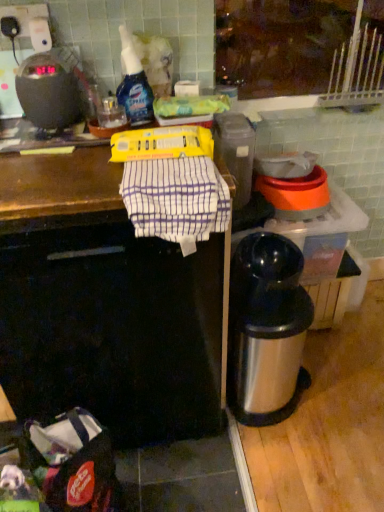
Question: Is black plastic scale at upper left to the left of silver metallic thermos at lower right from the viewer's perspective?

Choices:
 (A) no
 (B) yes

Answer: (B)

Question: Considering the relative positions of black plastic scale at upper left and silver metallic thermos at lower right in the image provided, is black plastic scale at upper left behind silver metallic thermos at lower right?

Choices:
 (A) yes
 (B) no

Answer: (B)

Question: Is black plastic scale at upper left thinner than silver metallic thermos at lower right?

Choices:
 (A) no
 (B) yes

Answer: (B)

Question: From the image's perspective, is black plastic scale at upper left located beneath silver metallic thermos at lower right?

Choices:
 (A) no
 (B) yes

Answer: (A)

Question: Can you confirm if black plastic scale at upper left is shorter than silver metallic thermos at lower right?

Choices:
 (A) yes
 (B) no

Answer: (A)

Question: In terms of height, does translucent plastic spray bottle at upper center look taller or shorter compared to black plastic scale at upper left?

Choices:
 (A) short
 (B) tall

Answer: (B)

Question: Based on their sizes in the image, would you say translucent plastic spray bottle at upper center is bigger or smaller than black plastic scale at upper left?

Choices:
 (A) big
 (B) small

Answer: (B)

Question: Is point (122, 103) closer or farther from the camera than point (46, 60)?

Choices:
 (A) closer
 (B) farther

Answer: (B)

Question: From the image's perspective, is translucent plastic spray bottle at upper center above or below black plastic scale at upper left?

Choices:
 (A) above
 (B) below

Answer: (A)

Question: Looking at their shapes, would you say translucent plastic spray bottle at upper center is wider or thinner than silver metallic thermos at lower right?

Choices:
 (A) wide
 (B) thin

Answer: (B)

Question: From the image's perspective, is translucent plastic spray bottle at upper center positioned above or below silver metallic thermos at lower right?

Choices:
 (A) above
 (B) below

Answer: (A)

Question: Considering their positions, is translucent plastic spray bottle at upper center located in front of or behind silver metallic thermos at lower right?

Choices:
 (A) front
 (B) behind

Answer: (A)

Question: In terms of size, does translucent plastic spray bottle at upper center appear bigger or smaller than silver metallic thermos at lower right?

Choices:
 (A) big
 (B) small

Answer: (B)

Question: Considering the positions of white striped cloth at center and silver metallic thermos at lower right in the image, is white striped cloth at center taller or shorter than silver metallic thermos at lower right?

Choices:
 (A) short
 (B) tall

Answer: (A)

Question: Considering the positions of white striped cloth at center and silver metallic thermos at lower right in the image, is white striped cloth at center bigger or smaller than silver metallic thermos at lower right?

Choices:
 (A) big
 (B) small

Answer: (B)